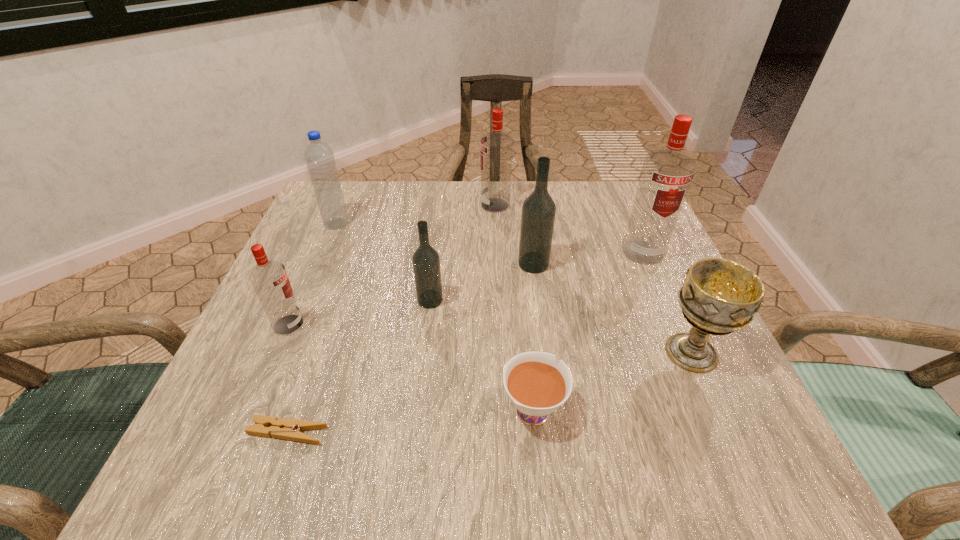
You are a GUI agent. You are given a task and a screenshot of the screen. Output one action in this format:
    pyautogui.click(x=<x>, y=<y>)
    Task: Click on the water bottle present at the far edge
    Image resolution: width=960 pixels, height=540 pixels.
    Given the screenshot: What is the action you would take?
    pyautogui.click(x=319, y=157)

The image size is (960, 540). Identify the location of teacup at the near edge. (537, 387).

I want to click on clothespin that is positioned at the near edge, so click(283, 428).

This screenshot has width=960, height=540. What are the coordinates of `water bottle located in the left edge section of the desktop` in the screenshot? It's located at (319, 157).

Where is `vodka that is at the left edge`? vodka that is at the left edge is located at coordinates (269, 278).

Locate an element on the screen. This screenshot has width=960, height=540. clothespin present at the left edge is located at coordinates (283, 428).

You are a GUI agent. You are given a task and a screenshot of the screen. Output one action in this format:
    pyautogui.click(x=<x>, y=<y>)
    Task: Click on the vodka that is at the right edge
    
    Given the screenshot: What is the action you would take?
    pyautogui.click(x=666, y=175)

Locate an element on the screen. chalice that is at the right edge is located at coordinates (719, 296).

This screenshot has width=960, height=540. What are the coordinates of `object that is at the far left corner` in the screenshot? It's located at (319, 157).

Image resolution: width=960 pixels, height=540 pixels. I want to click on object at the near left corner, so click(x=283, y=428).